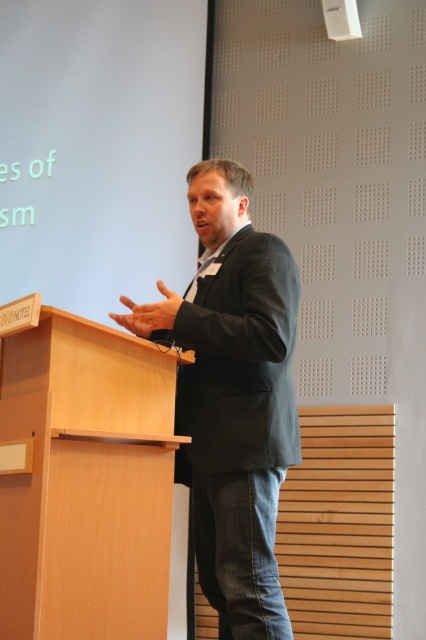
Does light wood podium at left have a lesser width compared to dark gray suit at center?

Incorrect, light wood podium at left's width is not less than dark gray suit at center's.

Between point (17, 525) and point (261, 486), which one is positioned behind?

The point (261, 486) is more distant.

The height and width of the screenshot is (640, 426). In order to click on light wood podium at left in this screenshot , I will do `click(85, 481)`.